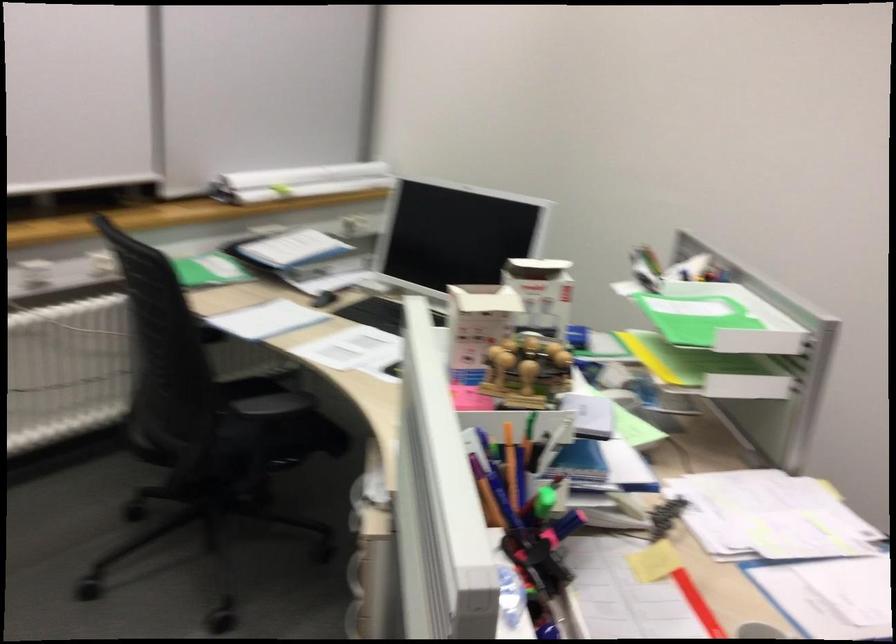
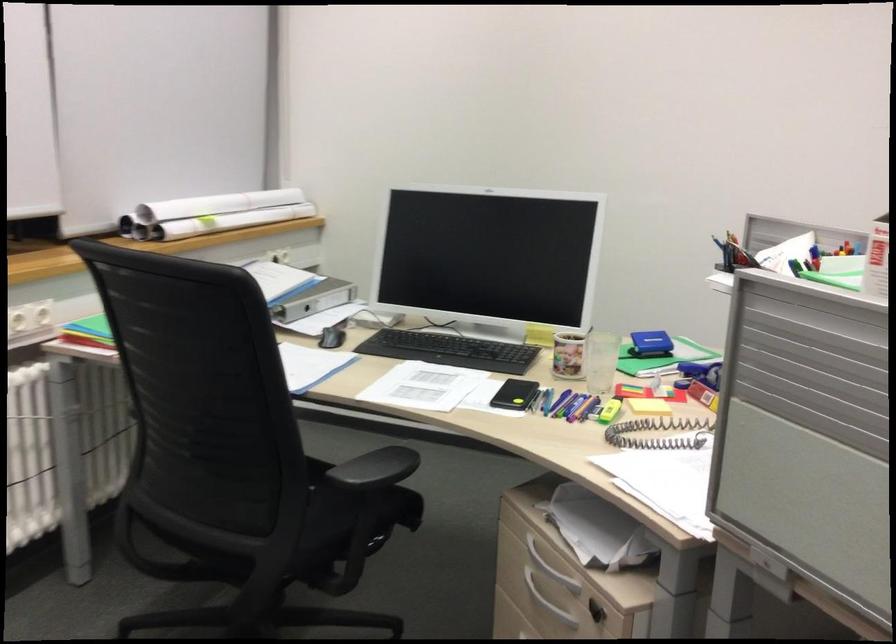
The point at (330, 267) is marked in the first image. Where is the corresponding point in the second image?

(314, 299)